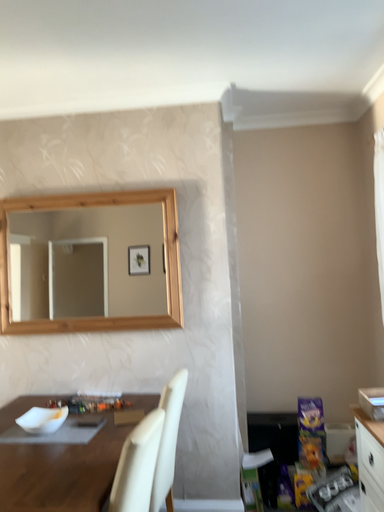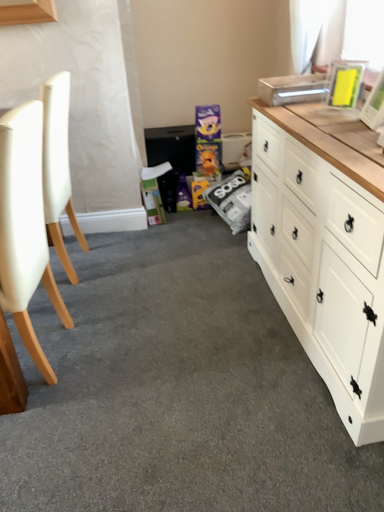
Question: Which way did the camera rotate in the video?

Choices:
 (A) rotated upward
 (B) rotated downward

Answer: (B)